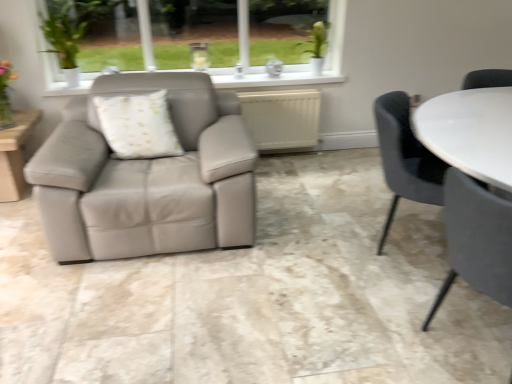
What do you see at coordinates (15, 154) in the screenshot? This screenshot has width=512, height=384. I see `wooden table at left` at bounding box center [15, 154].

At what (x,y) coordinates should I click in order to perform the action: click on wooden table at left. Please return your answer as a coordinate pair (x, y). The width and height of the screenshot is (512, 384). Looking at the image, I should click on (15, 154).

Locate an element on the screen. The width and height of the screenshot is (512, 384). wooden table at left is located at coordinates (15, 154).